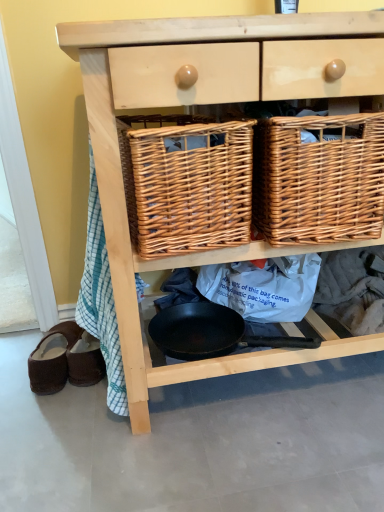
Question: Can woven brown picnic basket at center, the 1th picnic basket from the left, be found inside woven brown picnic basket at center, placed as the 1th picnic basket when sorted from right to left?

Choices:
 (A) yes
 (B) no

Answer: (B)

Question: Does woven brown picnic basket at center, placed as the 1th picnic basket when sorted from right to left, have a lesser width compared to woven brown picnic basket at center, the second picnic basket positioned from the right?

Choices:
 (A) yes
 (B) no

Answer: (B)

Question: Does woven brown picnic basket at center, which is counted as the second picnic basket, starting from the left, have a greater height compared to woven brown picnic basket at center, the second picnic basket positioned from the right?

Choices:
 (A) no
 (B) yes

Answer: (B)

Question: Is woven brown picnic basket at center, which is counted as the second picnic basket, starting from the left, to the left of woven brown picnic basket at center, the second picnic basket positioned from the right, from the viewer's perspective?

Choices:
 (A) no
 (B) yes

Answer: (A)

Question: Is woven brown picnic basket at center, placed as the 1th picnic basket when sorted from right to left, facing towards woven brown picnic basket at center, the second picnic basket positioned from the right?

Choices:
 (A) no
 (B) yes

Answer: (A)

Question: In terms of width, does natural wood chest of drawers at center look wider or thinner when compared to woven brown picnic basket at center, the second picnic basket positioned from the right?

Choices:
 (A) wide
 (B) thin

Answer: (A)

Question: Is point (119, 242) closer or farther from the camera than point (168, 192)?

Choices:
 (A) closer
 (B) farther

Answer: (B)

Question: Is natural wood chest of drawers at center in front of or behind woven brown picnic basket at center, the second picnic basket positioned from the right, in the image?

Choices:
 (A) front
 (B) behind

Answer: (A)

Question: In the image, is natural wood chest of drawers at center on the left side or the right side of woven brown picnic basket at center, the 1th picnic basket from the left?

Choices:
 (A) right
 (B) left

Answer: (A)

Question: Looking at the image, does natural wood chest of drawers at center seem bigger or smaller compared to black non-stick frying pan at center?

Choices:
 (A) big
 (B) small

Answer: (A)

Question: Is natural wood chest of drawers at center to the left or to the right of black non-stick frying pan at center in the image?

Choices:
 (A) left
 (B) right

Answer: (B)

Question: Is natural wood chest of drawers at center in front of or behind black non-stick frying pan at center in the image?

Choices:
 (A) front
 (B) behind

Answer: (A)

Question: Do you think natural wood chest of drawers at center is within black non-stick frying pan at center, or outside of it?

Choices:
 (A) outside
 (B) inside

Answer: (A)

Question: Is woven brown picnic basket at center, which is counted as the second picnic basket, starting from the left, bigger or smaller than black non-stick frying pan at center?

Choices:
 (A) small
 (B) big

Answer: (B)

Question: Does point (345, 150) appear closer or farther from the camera than point (228, 335)?

Choices:
 (A) closer
 (B) farther

Answer: (A)